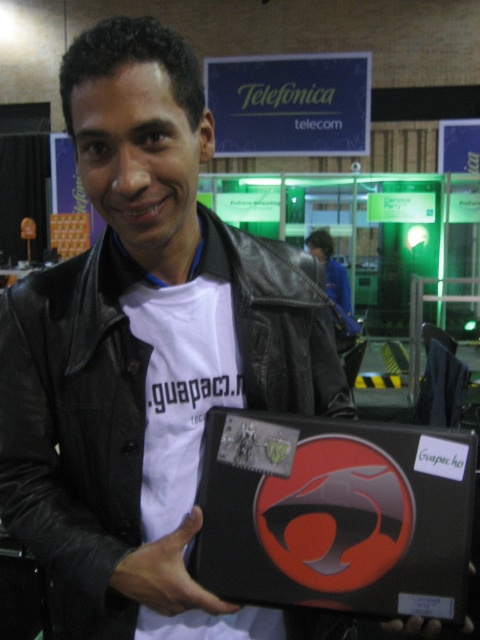
You are at a convention and need to navigate between two points marked on a map. The first point is at coordinate point (x=132, y=518) and the second is at coordinate point (x=167, y=602). According to the image, which point is closer to the front of the scene?

Point (x=167, y=602) is closer to the front of the scene because it is in front of point (x=132, y=518) as described.

You are a fashion designer observing a man wearing a black leather jacket at center and holding a black leather hand at center. Which item is taller?

The black leather jacket at center is taller than the black leather hand at center.

You are a fashion designer observing the man in the image. You need to determine which item is bigger between the black leather jacket at center and the black leather hand at center. Which one is larger?

The black leather jacket at center is larger in size than the black leather hand at center.